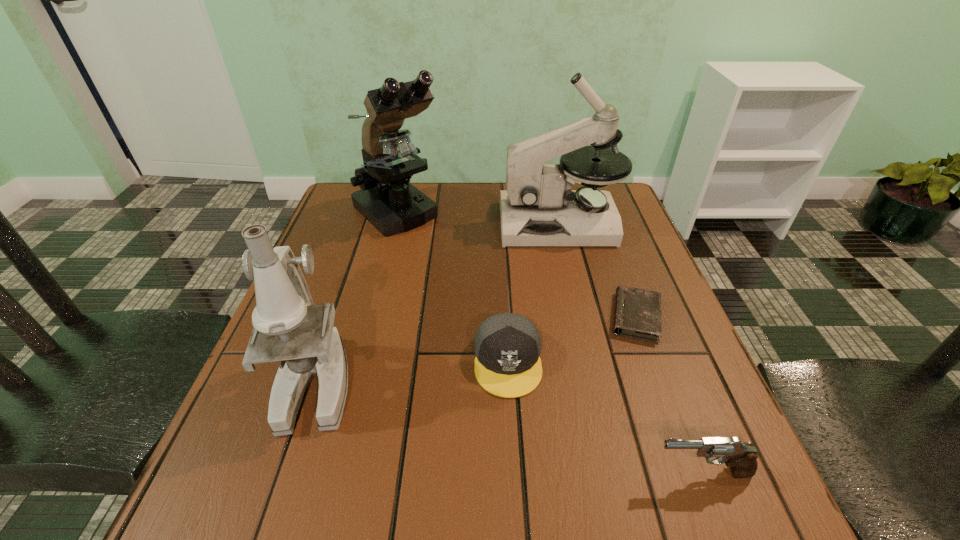
Find the location of a particular element. The width and height of the screenshot is (960, 540). vacant space located 0.230m at the barrel of the nearest object is located at coordinates (504, 472).

This screenshot has width=960, height=540. Find the location of `vacant space located at the barrel of the nearest object`. vacant space located at the barrel of the nearest object is located at coordinates (556, 472).

Find the location of a particular element. vacant space located at the barrel of the nearest object is located at coordinates (460, 472).

The height and width of the screenshot is (540, 960). I want to click on free location located 0.150m on the front-facing side of the second shortest object, so click(515, 483).

Locate an element on the screen. This screenshot has width=960, height=540. free space located 0.310m on the left of the shortest object is located at coordinates (462, 317).

Image resolution: width=960 pixels, height=540 pixels. I want to click on object present at the near edge, so click(x=741, y=458).

At what (x,y) coordinates should I click in order to perform the action: click on microscope located at the right edge. Please return your answer as a coordinate pair (x, y). Looking at the image, I should click on (538, 208).

Identify the location of pistol that is at the right edge. The image size is (960, 540). (741, 458).

Image resolution: width=960 pixels, height=540 pixels. Identify the location of diary located at the right edge. (637, 314).

Identify the location of object located at the far left corner. (387, 200).